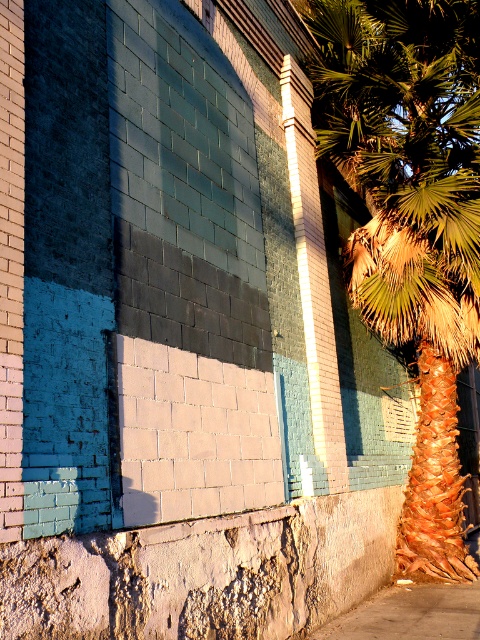
Question: Can you confirm if green leafy palm at right is positioned below gray concrete pavement at lower right?

Choices:
 (A) no
 (B) yes

Answer: (A)

Question: Does green leafy palm at right appear on the right side of gray concrete pavement at lower right?

Choices:
 (A) no
 (B) yes

Answer: (B)

Question: Is green leafy palm at right closer to camera compared to gray concrete pavement at lower right?

Choices:
 (A) no
 (B) yes

Answer: (A)

Question: Which object is farther from the camera taking this photo?

Choices:
 (A) gray concrete pavement at lower right
 (B) green leafy palm at right

Answer: (B)

Question: Which point appears farthest from the camera in this image?

Choices:
 (A) (452, 600)
 (B) (377, 84)

Answer: (B)

Question: Which of the following is the closest to the observer?

Choices:
 (A) pyautogui.click(x=373, y=92)
 (B) pyautogui.click(x=468, y=608)

Answer: (B)